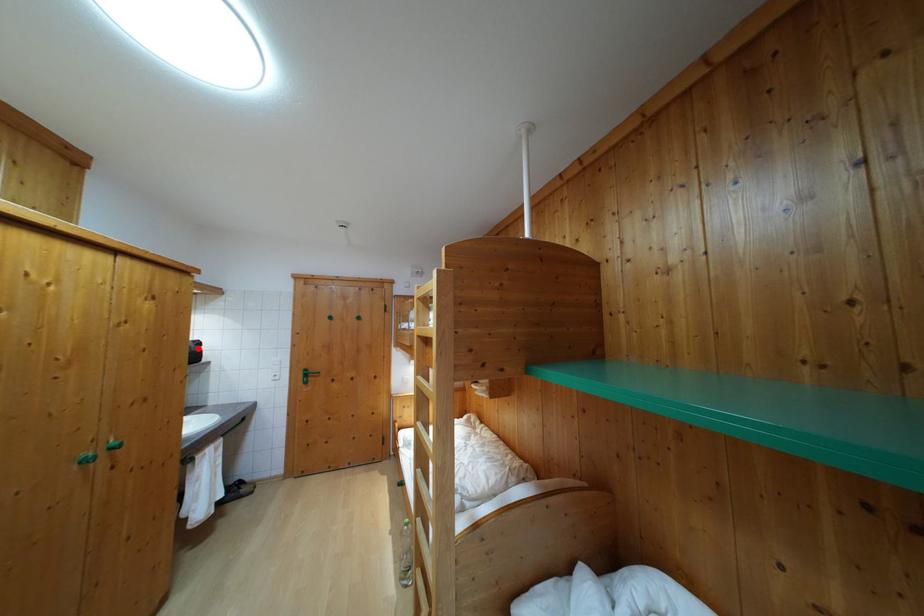
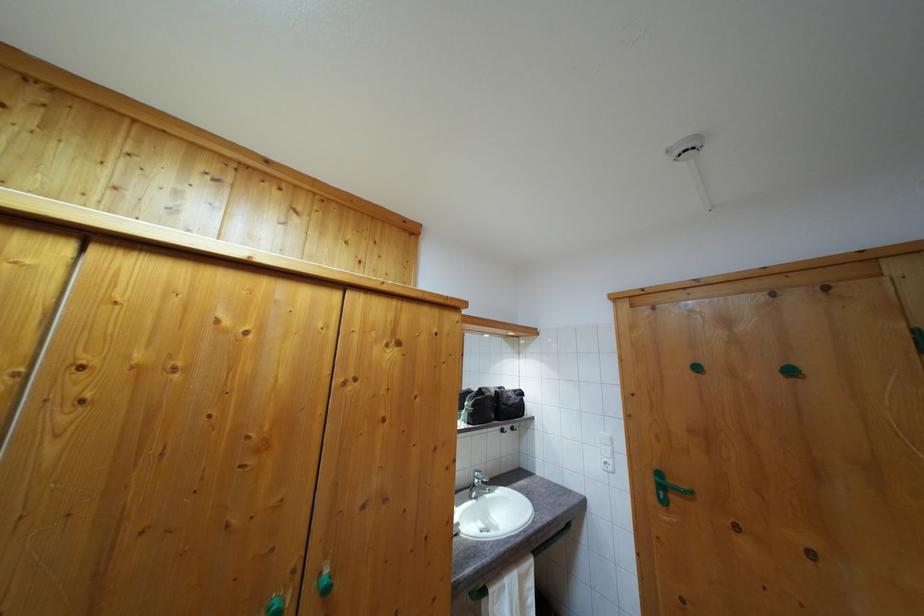
Where in the second image is the point corresponding to the highlighted location from the first image?

(518, 398)